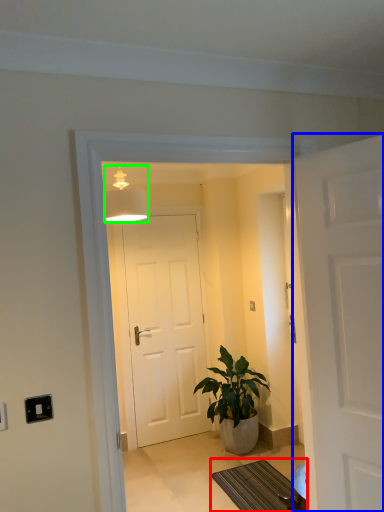
Question: Considering the real-world distances, which object is farthest from doormat (highlighted by a red box)? door (highlighted by a blue box) or lamp (highlighted by a green box)?

Choices:
 (A) door
 (B) lamp

Answer: (B)